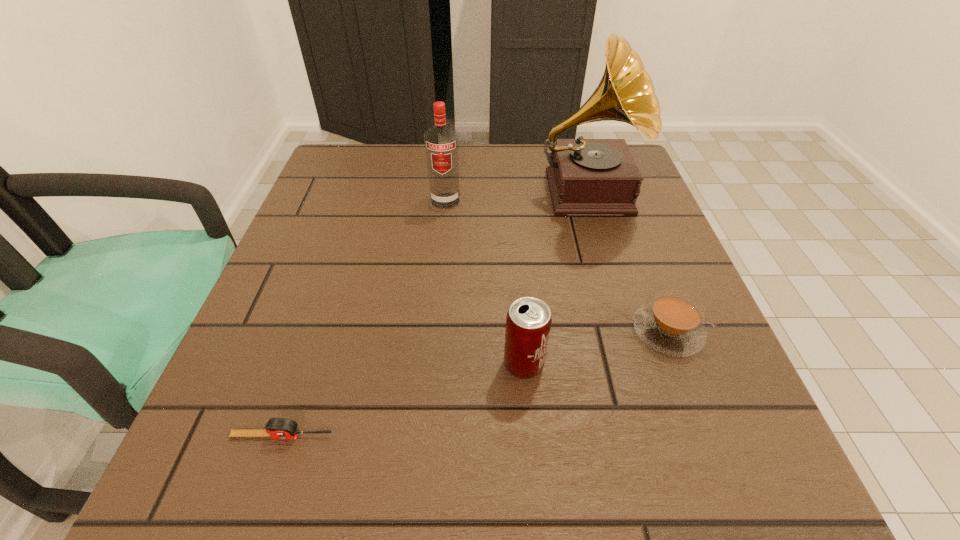
Where is `vacant space positioned on the back of the third object from left to right`? vacant space positioned on the back of the third object from left to right is located at coordinates (516, 272).

The image size is (960, 540). What are the coordinates of `free space located 0.080m on the back of the fourth tallest object` in the screenshot? It's located at (646, 273).

Locate an element on the screen. This screenshot has height=540, width=960. vacant space located on the right of the shortest object is located at coordinates (468, 436).

The height and width of the screenshot is (540, 960). Identify the location of phonograph record that is at the far edge. (586, 176).

Image resolution: width=960 pixels, height=540 pixels. Identify the location of vodka situated at the far edge. (441, 142).

Identify the location of object present at the left edge. The height and width of the screenshot is (540, 960). 277,428.

In order to click on phonograph record positioned at the right edge in this screenshot , I will do `click(586, 176)`.

At what (x,y) coordinates should I click in order to perform the action: click on cappuccino situated at the right edge. Please return your answer as a coordinate pair (x, y). The image size is (960, 540). Looking at the image, I should click on (672, 324).

Locate an element on the screen. object at the far right corner is located at coordinates (586, 176).

This screenshot has height=540, width=960. In order to click on vacant space at the far edge in this screenshot , I will do `click(502, 195)`.